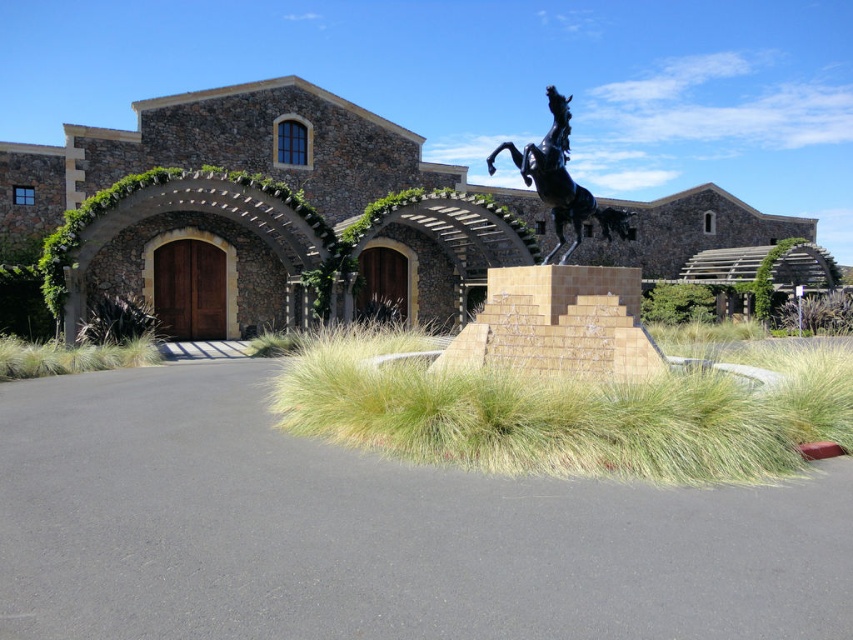
Describe the element at coordinates (373, 532) in the screenshot. I see `black asphalt at center` at that location.

Which is in front, point (685, 589) or point (645, 435)?

Point (685, 589)

Where is `black asphalt at center`? black asphalt at center is located at coordinates (373, 532).

Does black polished horse at center appear on the left side of green grass at lower left?

In fact, black polished horse at center is to the right of green grass at lower left.

Who is shorter, black polished horse at center or green grass at lower left?

green grass at lower left

Where is `black polished horse at center`? The image size is (853, 640). black polished horse at center is located at coordinates (561, 180).

Describe the element at coordinates (569, 410) in the screenshot. This screenshot has height=640, width=853. I see `green grass at center` at that location.

Between point (489, 384) and point (489, 168), which one is positioned behind?

Point (489, 168)

Between point (648, 458) and point (604, 227), which one is positioned in front?

Positioned in front is point (648, 458).

Find the location of a particular element. The width and height of the screenshot is (853, 640). green grass at center is located at coordinates (569, 410).